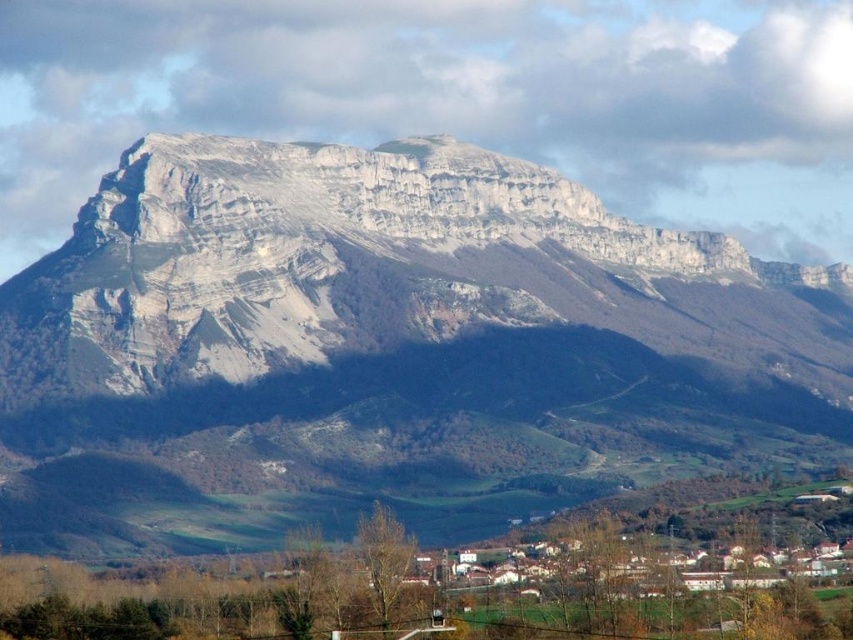
Is white rocky mountain range at upper center taller than white matte houses at lower center?

Yes, white rocky mountain range at upper center is taller than white matte houses at lower center.

Looking at this image, measure the distance between point [33,488] and camera.

Point [33,488] is 668.96 meters away from camera.

Identify the location of white rocky mountain range at upper center. The width and height of the screenshot is (853, 640). (386, 348).